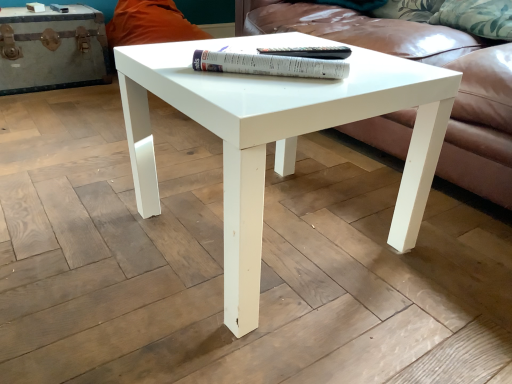
Image resolution: width=512 pixels, height=384 pixels. In order to click on vacant space to the left of white glossy coffee table at center in this screenshot , I will do pyautogui.click(x=91, y=225).